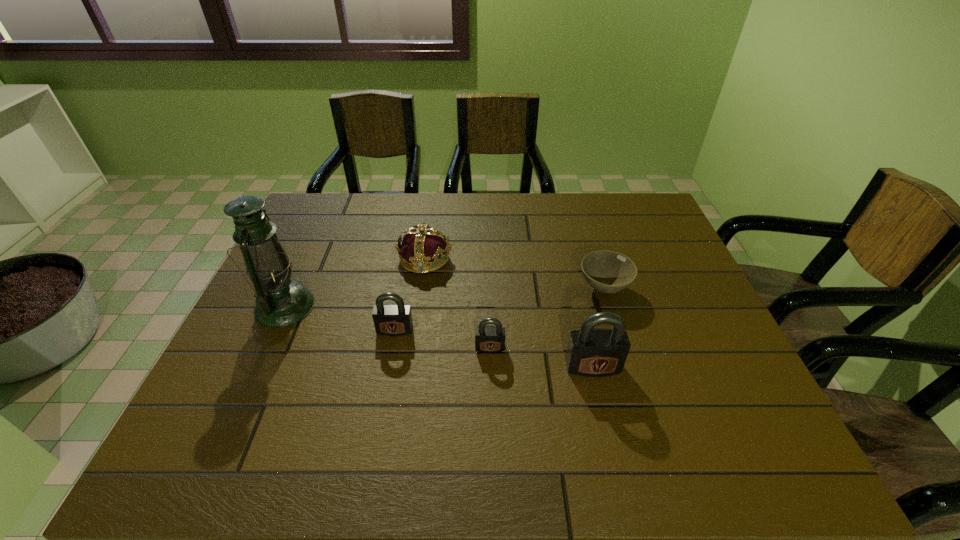
Observe the arrangement of all padlocks in the image. To keep them evenly spaced, where would you place another padlock on the right? Please locate a free space. Please provide its 2D coordinates. Your answer should be formatted as a tuple, i.e. [(x, y)], where the tuple contains the x and y coordinates of a point satisfying the conditions above.

[(705, 387)]